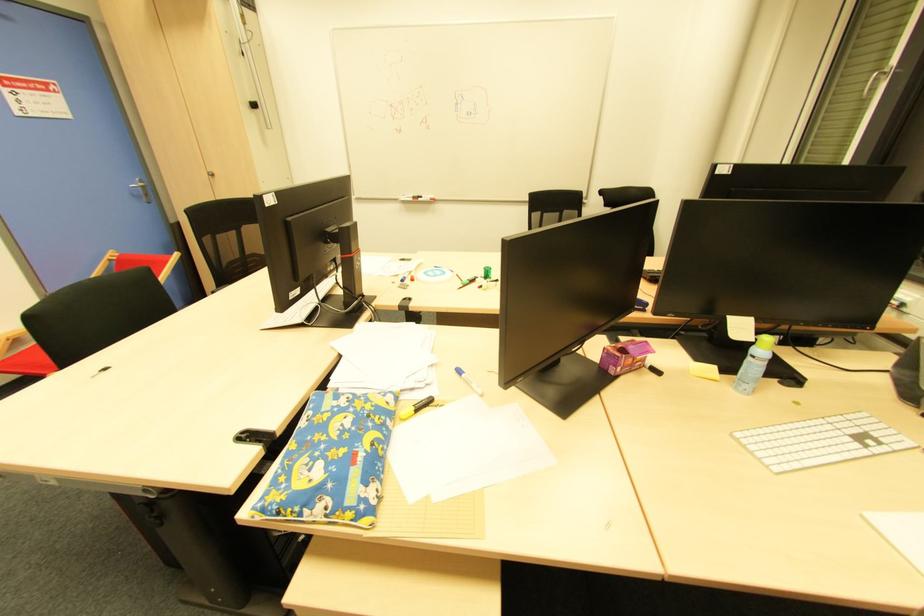
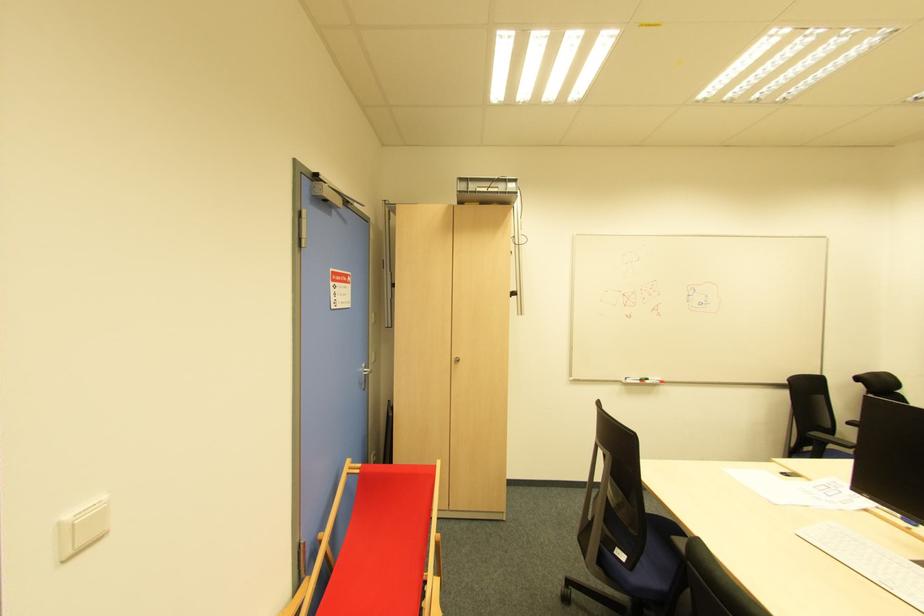
Where in the second image is the point corresponding to point 433,201 from the first image?

(662, 383)